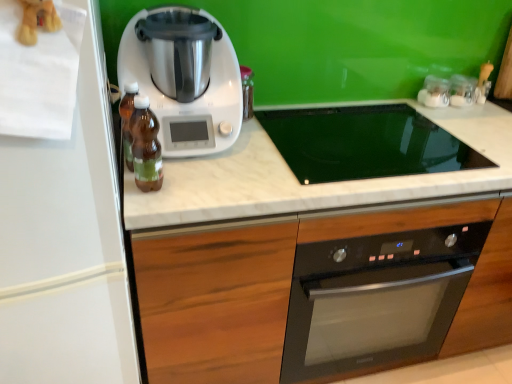
The height and width of the screenshot is (384, 512). Identify the location of vacant space that is to the left of clear glass jars at upper right, the 2th appliance when ordered from right to left. (390, 105).